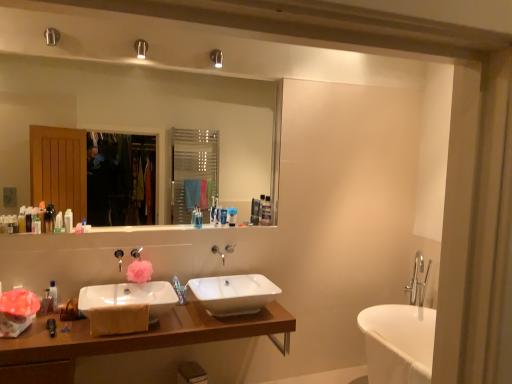
Question: Is blue matte toothpaste tube at center, which appears as the ninth toiletry when viewed from the left, outside white glossy bottle at left, which is the sixth toiletry in right-to-left order?

Choices:
 (A) no
 (B) yes

Answer: (B)

Question: Is white glossy bottle at left, which is the sixth toiletry in right-to-left order, at the back of blue matte toothpaste tube at center, placed as the 4th toiletry when sorted from right to left?

Choices:
 (A) yes
 (B) no

Answer: (B)

Question: Can you confirm if blue matte toothpaste tube at center, which appears as the ninth toiletry when viewed from the left, is positioned to the right of white glossy bottle at left, which is the sixth toiletry in right-to-left order?

Choices:
 (A) no
 (B) yes

Answer: (B)

Question: From a real-world perspective, does blue matte toothpaste tube at center, placed as the 4th toiletry when sorted from right to left, sit lower than white glossy bottle at left, which is the sixth toiletry in right-to-left order?

Choices:
 (A) yes
 (B) no

Answer: (B)

Question: Is blue matte toothpaste tube at center, which appears as the ninth toiletry when viewed from the left, oriented towards white glossy bottle at left, which is the sixth toiletry in right-to-left order?

Choices:
 (A) yes
 (B) no

Answer: (B)

Question: Is white glossy bottle at left, the seventh toiletry positioned from the left, a part of blue matte toothpaste tube at center, which appears as the ninth toiletry when viewed from the left?

Choices:
 (A) yes
 (B) no

Answer: (B)

Question: Is clear plastic bottle at upper center, which ranks as the second toiletry in right-to-left order, facing towards translucent plastic container at upper center, positioned as the 1th toiletry in right-to-left order?

Choices:
 (A) no
 (B) yes

Answer: (A)

Question: Is clear plastic bottle at upper center, which appears as the 11th toiletry when viewed from the left, bigger than translucent plastic container at upper center, positioned as the 1th toiletry in right-to-left order?

Choices:
 (A) no
 (B) yes

Answer: (A)

Question: Does clear plastic bottle at upper center, which appears as the 11th toiletry when viewed from the left, appear on the right side of translucent plastic container at upper center, arranged as the 12th toiletry when viewed from the left?

Choices:
 (A) yes
 (B) no

Answer: (B)

Question: Is clear plastic bottle at upper center, which ranks as the second toiletry in right-to-left order, further to the viewer compared to translucent plastic container at upper center, arranged as the 12th toiletry when viewed from the left?

Choices:
 (A) yes
 (B) no

Answer: (B)

Question: From a real-world perspective, is clear plastic bottle at upper center, which ranks as the second toiletry in right-to-left order, physically below translucent plastic container at upper center, positioned as the 1th toiletry in right-to-left order?

Choices:
 (A) yes
 (B) no

Answer: (A)

Question: Does clear plastic bottle at upper center, which ranks as the second toiletry in right-to-left order, have a lesser width compared to translucent plastic container at upper center, arranged as the 12th toiletry when viewed from the left?

Choices:
 (A) yes
 (B) no

Answer: (A)

Question: Is translucent plastic bottle at left, which is counted as the fifth toiletry, starting from the left, facing away from white ceramic sink at lower left, positioned as the first sink in left-to-right order?

Choices:
 (A) yes
 (B) no

Answer: (B)